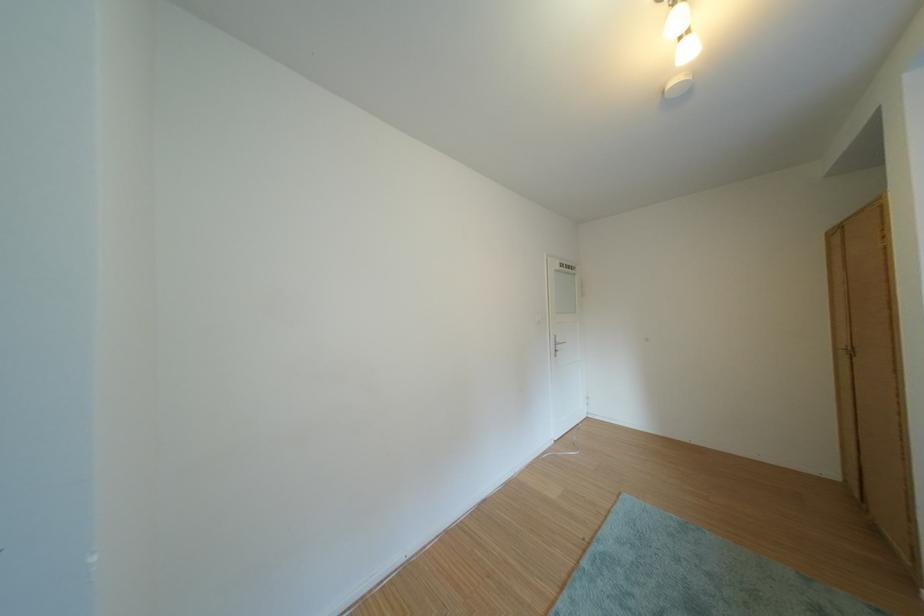
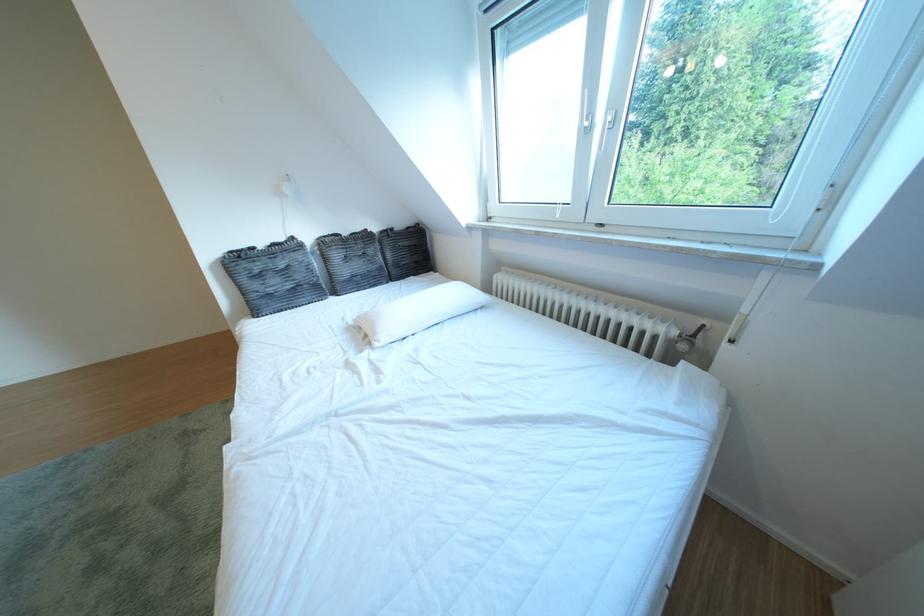
Based on the continuous images, in which direction is the camera rotating?

The camera's rotation is toward right-down.